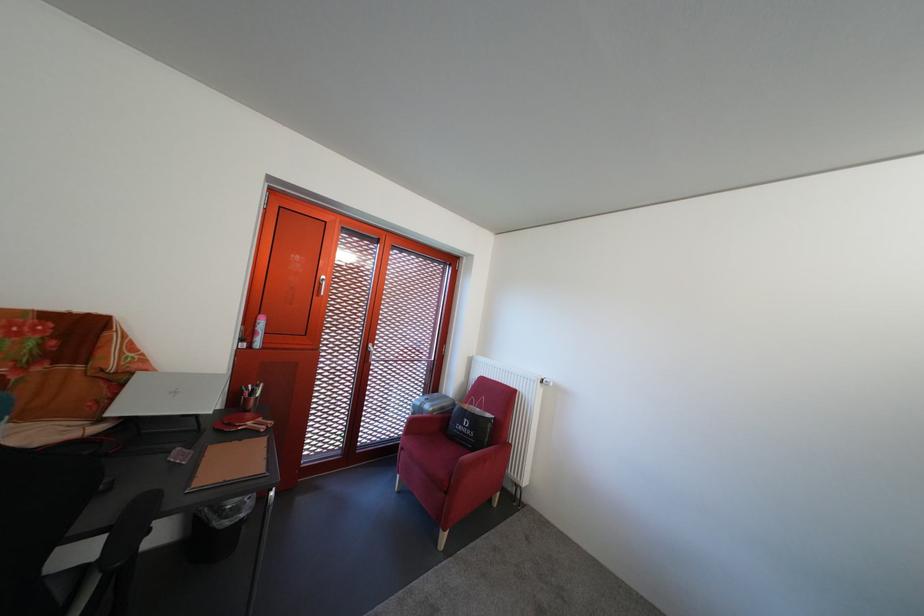
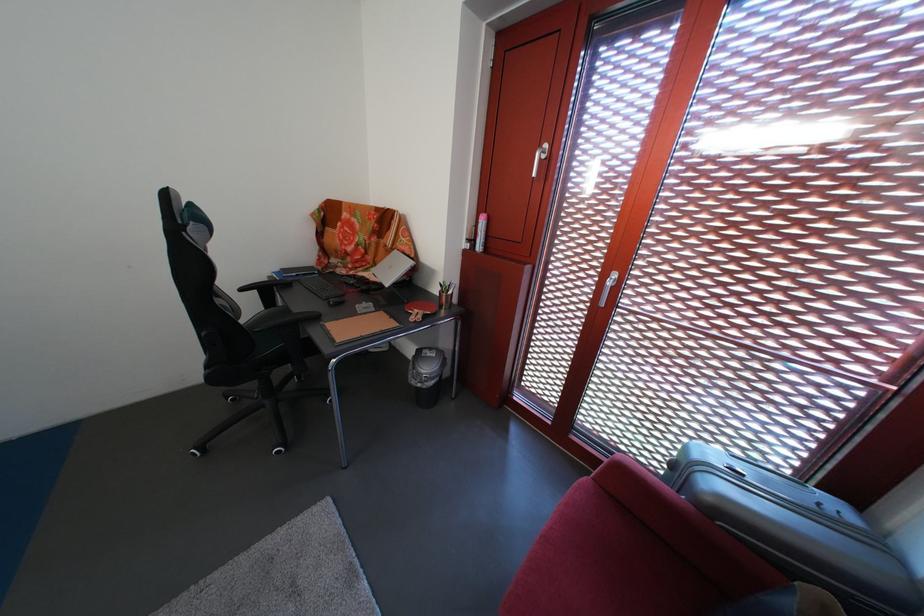
The point at (237, 530) is marked in the first image. Where is the corresponding point in the second image?

(424, 389)